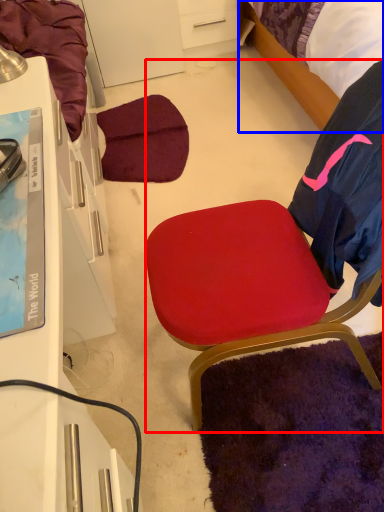
Question: Among these objects, which one is farthest to the camera, chair (highlighted by a red box) or bed (highlighted by a blue box)?

Choices:
 (A) chair
 (B) bed

Answer: (B)